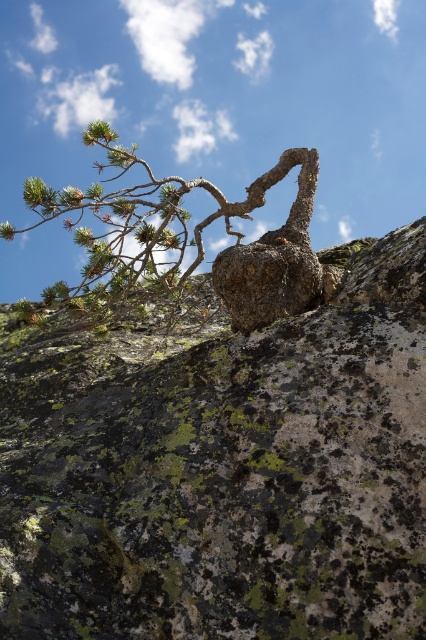
You are a geologist examining the rock formations in the image. You notice two distinct rocks labeled as rough textured rock at upper left and green textured rock at upper center. Based on their positions, which rock is positioned further to the left?

The green textured rock at upper center is positioned further to the left compared to the rough textured rock at upper left, as the rough textured rock at upper left is to the right of green textured rock at upper center.

You are an explorer trying to cross a rocky terrain. You have to step on the rough textured rock at upper left and the green textured rock at upper center. Which rock should you step on first if you want to move from left to right?

You should step on the rough textured rock at upper left first since it is located on the left side of the green textured rock at upper center, allowing you to move from left to right as intended.

You are a hiker standing at the base of the large rock formation. You notice two points marked on the rock surface. One is at coordinate point (265,509) and the other at point (66,289). Which point is more likely to be in a shadow if the sun is directly in front of you?

Point (66,289) is farther from the viewer, so it might be in shadow if the sun is in front of you, as it could be on the back side of the rock formation.